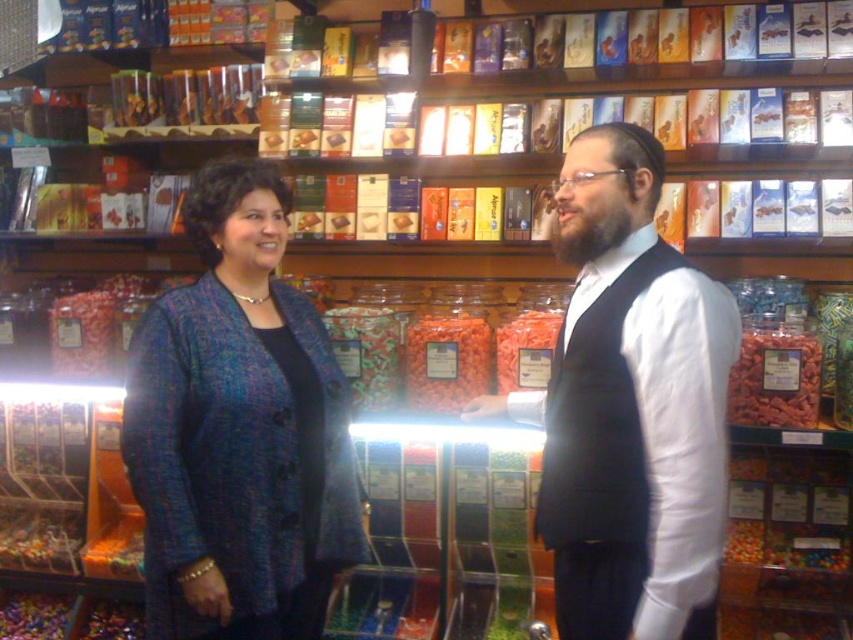
Does blue textured blazer at center lie in front of matte black vest at center?

→ No, it is not.

The width and height of the screenshot is (853, 640). I want to click on blue textured blazer at center, so click(x=238, y=429).

Where is `blue textured blazer at center`? blue textured blazer at center is located at coordinates (238, 429).